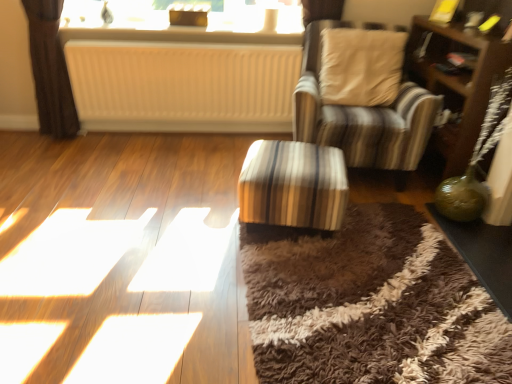
Question: Considering the relative positions of white textured radiator at upper center and striped fabric ottoman at center, which ranks as the first table in left-to-right order, in the image provided, is white textured radiator at upper center behind striped fabric ottoman at center, which ranks as the first table in left-to-right order,?

Choices:
 (A) yes
 (B) no

Answer: (A)

Question: From a real-world perspective, is white textured radiator at upper center positioned under striped fabric ottoman at center, positioned as the 2th table in right-to-left order, based on gravity?

Choices:
 (A) yes
 (B) no

Answer: (B)

Question: Considering the relative sizes of white textured radiator at upper center and striped fabric ottoman at center, which ranks as the first table in left-to-right order, in the image provided, is white textured radiator at upper center bigger than striped fabric ottoman at center, which ranks as the first table in left-to-right order,?

Choices:
 (A) no
 (B) yes

Answer: (A)

Question: From the image's perspective, does white textured radiator at upper center appear lower than striped fabric ottoman at center, positioned as the 2th table in right-to-left order?

Choices:
 (A) yes
 (B) no

Answer: (B)

Question: Does white textured radiator at upper center have a smaller size compared to striped fabric ottoman at center, which ranks as the first table in left-to-right order?

Choices:
 (A) yes
 (B) no

Answer: (A)

Question: Do you think striped fabric chair at center is within white ribbed radiator at center, or outside of it?

Choices:
 (A) inside
 (B) outside

Answer: (B)

Question: Is point (412, 168) closer or farther from the camera than point (116, 119)?

Choices:
 (A) farther
 (B) closer

Answer: (B)

Question: Looking at their shapes, would you say striped fabric chair at center is wider or thinner than white ribbed radiator at center?

Choices:
 (A) thin
 (B) wide

Answer: (B)

Question: In terms of height, does striped fabric chair at center look taller or shorter compared to white ribbed radiator at center?

Choices:
 (A) tall
 (B) short

Answer: (A)

Question: From a real-world perspective, relative to striped fabric ottoman at center, which ranks as the first table in left-to-right order, is green glass table at lower right, the second table when ordered from left to right, vertically above or below?

Choices:
 (A) below
 (B) above

Answer: (A)

Question: Looking at the image, does green glass table at lower right, the second table when ordered from left to right, seem bigger or smaller compared to striped fabric ottoman at center, which ranks as the first table in left-to-right order?

Choices:
 (A) small
 (B) big

Answer: (A)

Question: Is point (509, 236) closer or farther from the camera than point (265, 160)?

Choices:
 (A) farther
 (B) closer

Answer: (A)

Question: Based on their positions, is green glass table at lower right, the second table when ordered from left to right, located to the left or right of striped fabric ottoman at center, positioned as the 2th table in right-to-left order?

Choices:
 (A) right
 (B) left

Answer: (A)

Question: Is point (x=96, y=43) positioned closer to the camera than point (x=270, y=172)?

Choices:
 (A) closer
 (B) farther

Answer: (B)

Question: In the image, is white ribbed radiator at center on the left side or the right side of striped fabric ottoman at center, positioned as the 2th table in right-to-left order?

Choices:
 (A) right
 (B) left

Answer: (B)